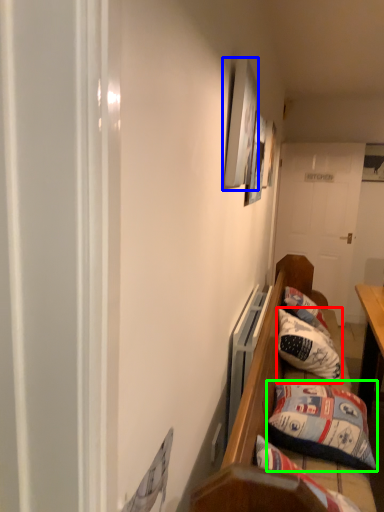
Question: Which is farther away from pillow (highlighted by a red box)? picture frame (highlighted by a blue box) or pillow (highlighted by a green box)?

Choices:
 (A) picture frame
 (B) pillow

Answer: (A)